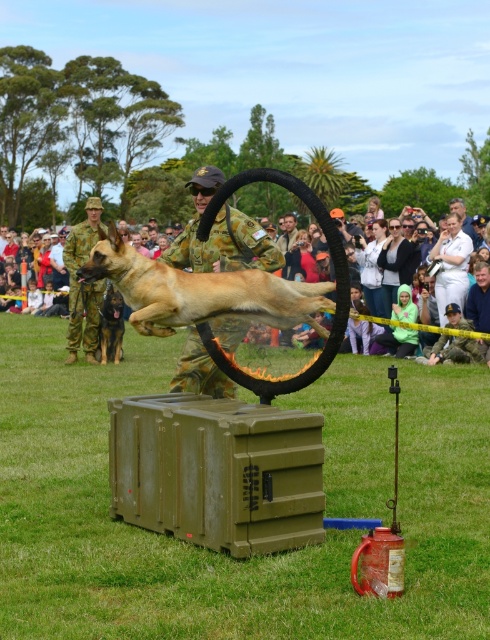
Can you confirm if golden fur dog at center is positioned above camouflage uniform at center?

Actually, golden fur dog at center is below camouflage uniform at center.

Does point (114, 282) come farther from viewer compared to point (218, 387)?

No, it is in front of (218, 387).

Identify the location of golden fur dog at center. (199, 291).

Does golden fur dog at center appear on the right side of brown fur dog at center?

Indeed, golden fur dog at center is positioned on the right side of brown fur dog at center.

Is golden fur dog at center positioned before brown fur dog at center?

Yes, golden fur dog at center is in front of brown fur dog at center.

Is point (173, 308) positioned in front of point (101, 321)?

Yes, point (173, 308) is closer to viewer.

The height and width of the screenshot is (640, 490). Identify the location of golden fur dog at center. (199, 291).

Can you confirm if camouflage uniform at center is bigger than brown fur dog at center?

Correct, camouflage uniform at center is larger in size than brown fur dog at center.

Is point (251, 244) positioned before point (115, 310)?

Yes, it is in front of point (115, 310).

Locate an element on the screen. camouflage uniform at center is located at coordinates [220, 236].